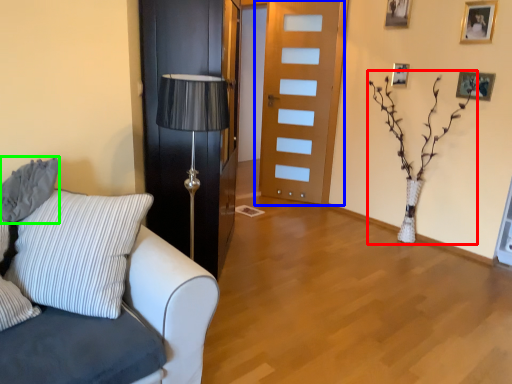
Question: Which object is the farthest from plant (highlighted by a red box)? Choose among these: door (highlighted by a blue box) or pillow (highlighted by a green box).

Choices:
 (A) door
 (B) pillow

Answer: (B)